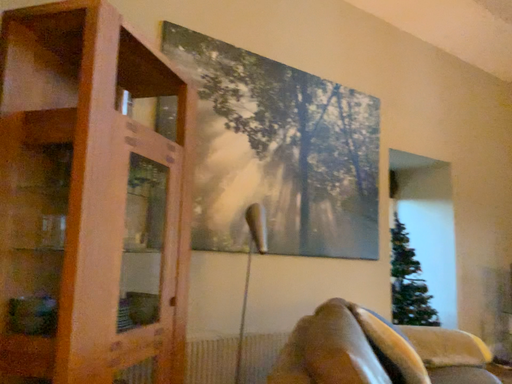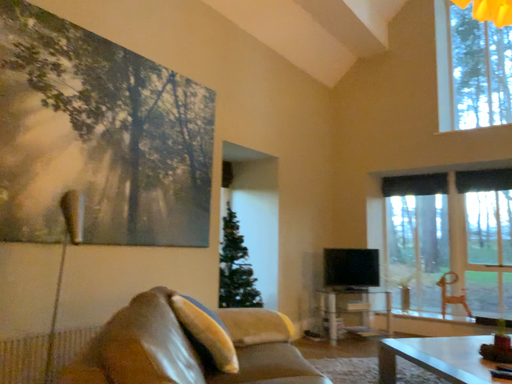
Question: Which way did the camera rotate in the video?

Choices:
 (A) rotated left
 (B) rotated right

Answer: (B)